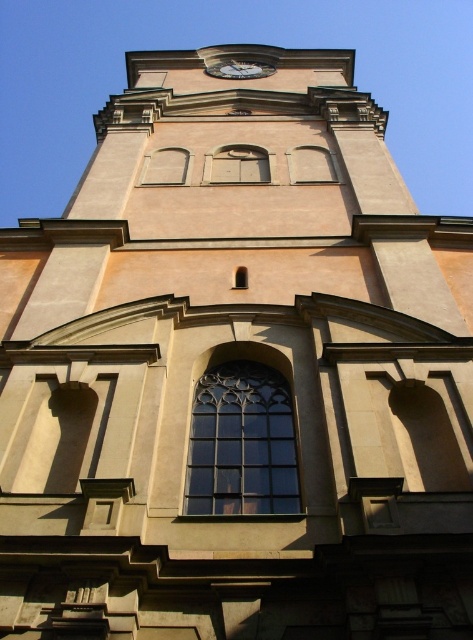
Which is above, dark glass window at center or clear glass window at center?

clear glass window at center is above.

Can you confirm if dark glass window at center is taller than clear glass window at center?

Indeed, dark glass window at center has a greater height compared to clear glass window at center.

Does point (220, 444) lie in front of point (309, 147)?

Yes, point (220, 444) is closer to viewer.

Where is `dark glass window at center`? This screenshot has width=473, height=640. dark glass window at center is located at coordinates (242, 442).

Does dark glass window at center have a lesser width compared to matte glass window at upper center?

No.

Describe the element at coordinates (242, 442) in the screenshot. Image resolution: width=473 pixels, height=640 pixels. I see `dark glass window at center` at that location.

Identify the location of dark glass window at center. The image size is (473, 640). (242, 442).

Consider the image. Who is more distant from viewer, (x=215, y=426) or (x=237, y=154)?

Positioned behind is point (x=237, y=154).

Which of these two, dark glass window at center or matte glass window at center, stands shorter?

matte glass window at center is shorter.

Who is more distant from viewer, [283,380] or [229,156]?

Point [229,156]

Locate an element on the screen. Image resolution: width=473 pixels, height=640 pixels. dark glass window at center is located at coordinates (242, 442).